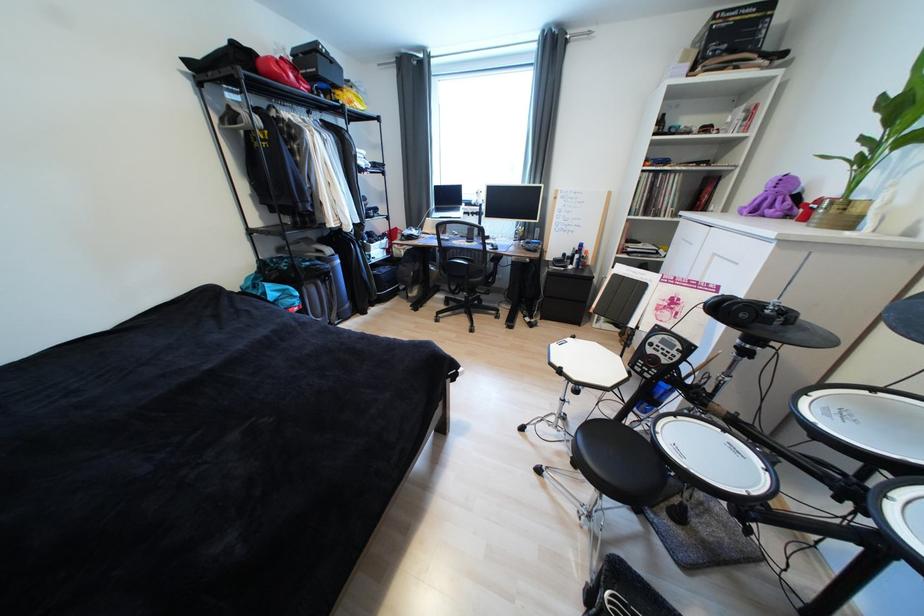
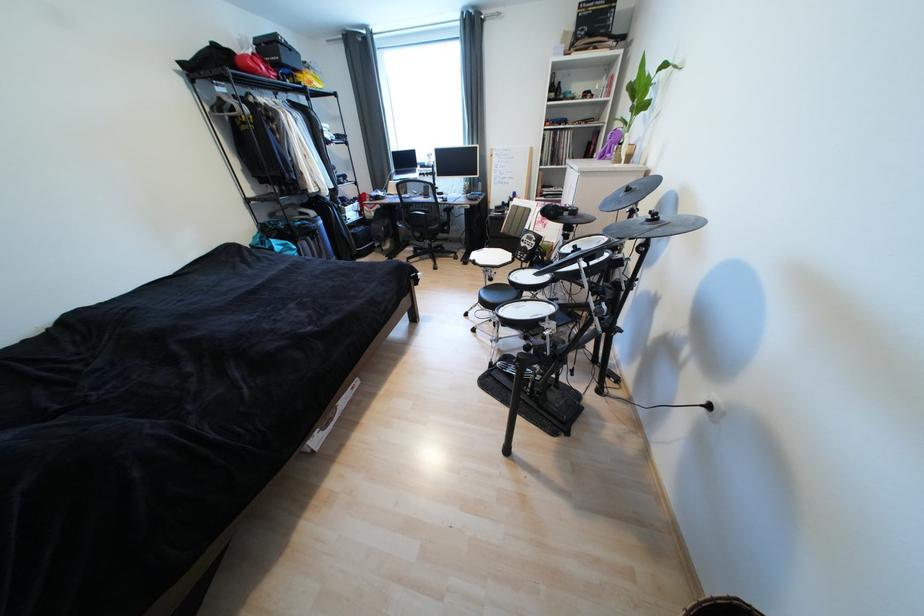
Where in the second image is the point corresponding to the point at 284,79 from the first image?

(261, 73)